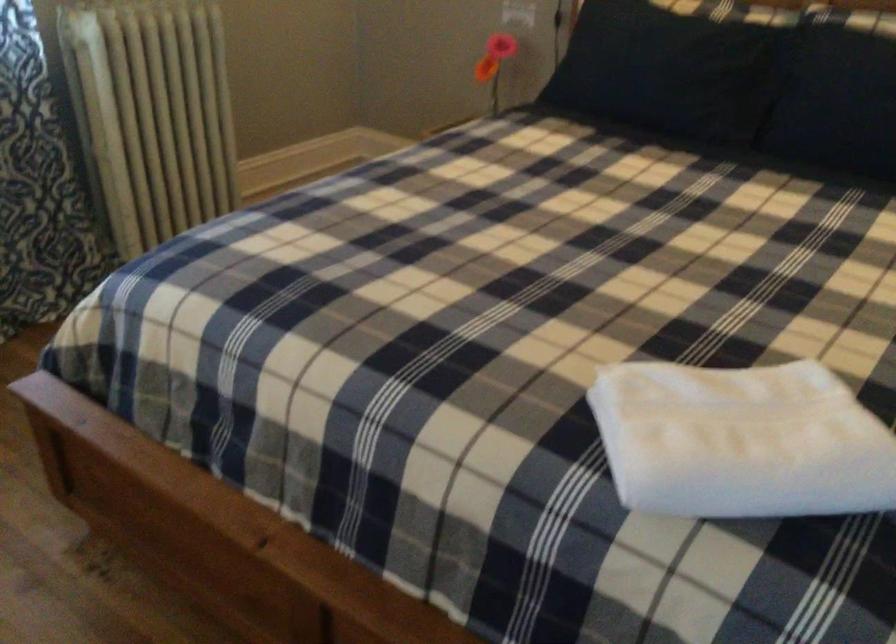
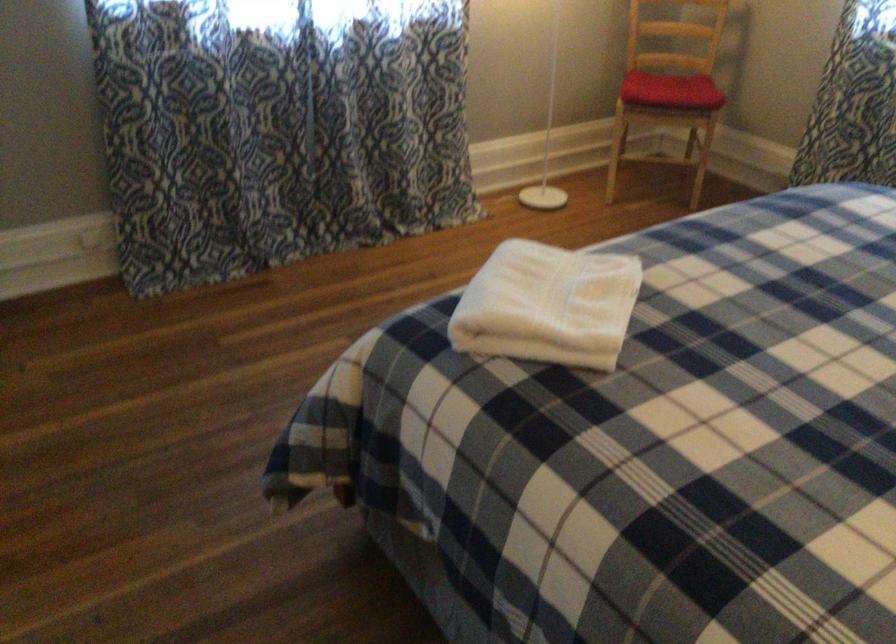
In the second image, find the point that corresponds to (737,420) in the first image.

(547, 305)